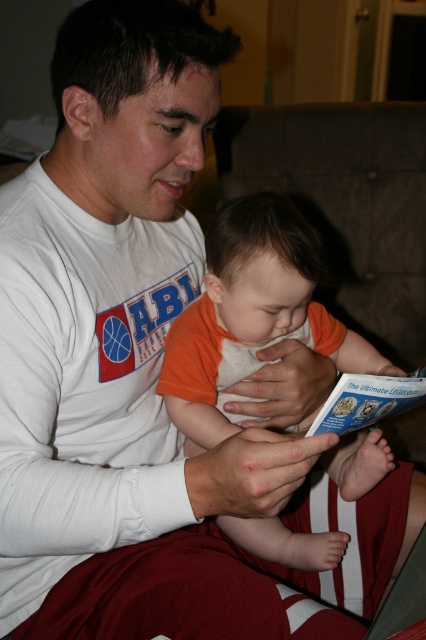
Based on the scene description, where is the orange cotton shirt at center located in terms of coordinates?

The orange cotton shirt at center is located at point coordinates of (250, 314).

You are a photographer standing at the camera position. You want to take a photo of the point at coordinates point (207,256). The focus range of your camera is set to 30 inches. Will the point be in focus?

The point point (207,256) is 33.44 inches away from the camera, which is beyond the focus range of 30 inches. Therefore, the point will not be in focus.

You are a tailor who needs to determine which item, the orange cotton shirt at center or the blue paper at center, requires more fabric for a new order. Based on the scene, which item needs more fabric?

The orange cotton shirt at center has a larger size compared to blue paper at center, so it requires more fabric for a new order.